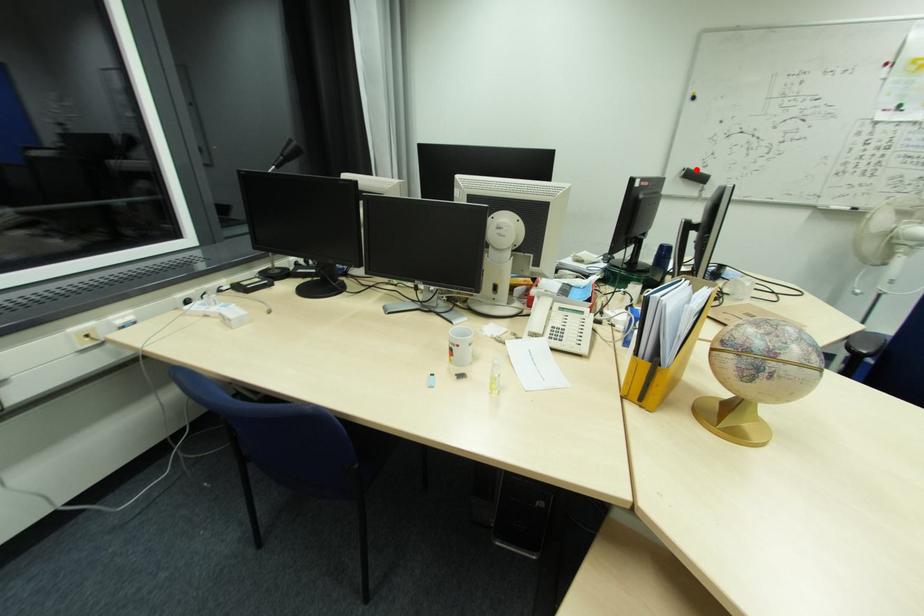
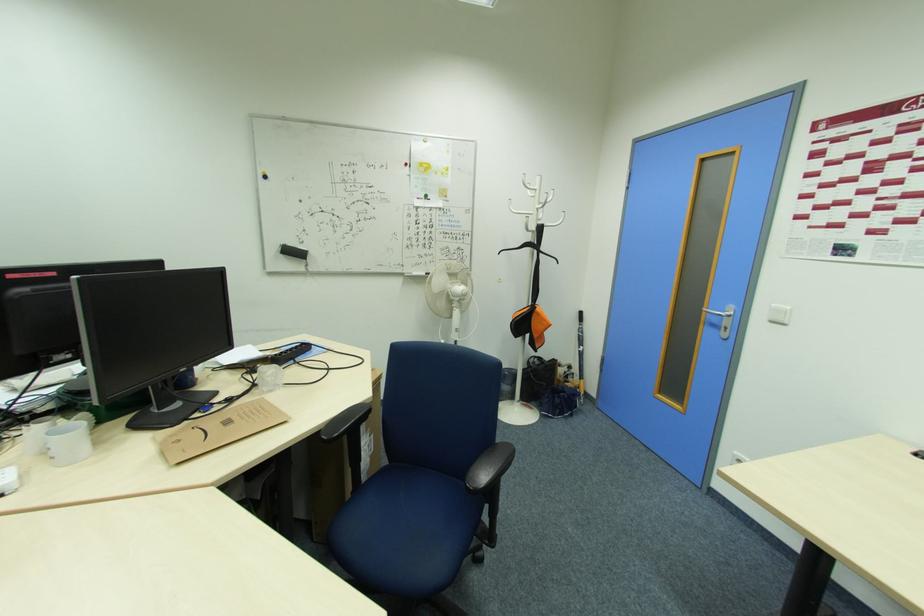
The point at the highlighted location is marked in the first image. Where is the corresponding point in the second image?

(294, 246)